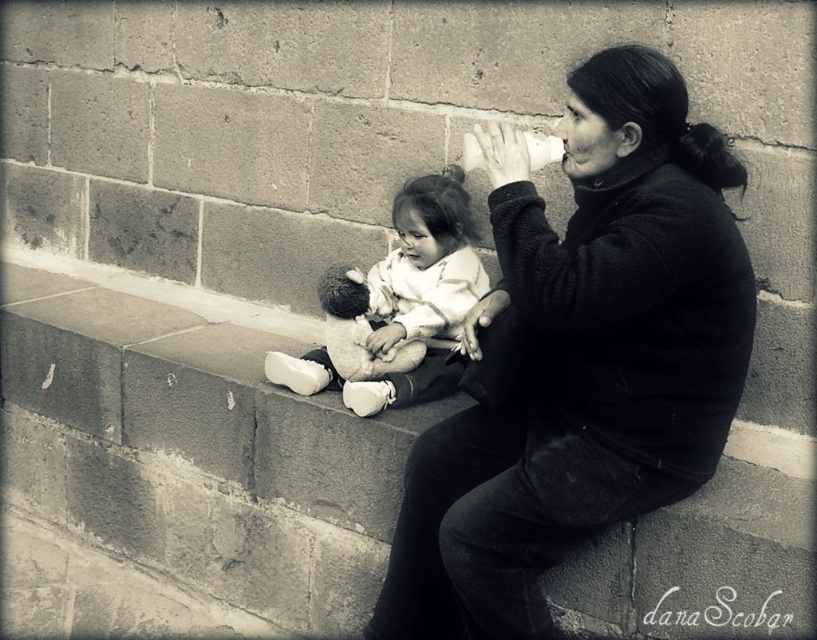
Question: Which of the following is the closest to the observer?

Choices:
 (A) (578, 454)
 (B) (408, 292)

Answer: (A)

Question: In this image, where is matte black jacket at center located relative to white plush doll at center?

Choices:
 (A) above
 (B) below

Answer: (B)

Question: Does matte black jacket at center have a lesser width compared to white plush doll at center?

Choices:
 (A) no
 (B) yes

Answer: (A)

Question: Which of the following is the farthest from the observer?

Choices:
 (A) matte black jacket at center
 (B) white plush doll at center

Answer: (B)

Question: Does matte black jacket at center have a larger size compared to white plush doll at center?

Choices:
 (A) no
 (B) yes

Answer: (B)